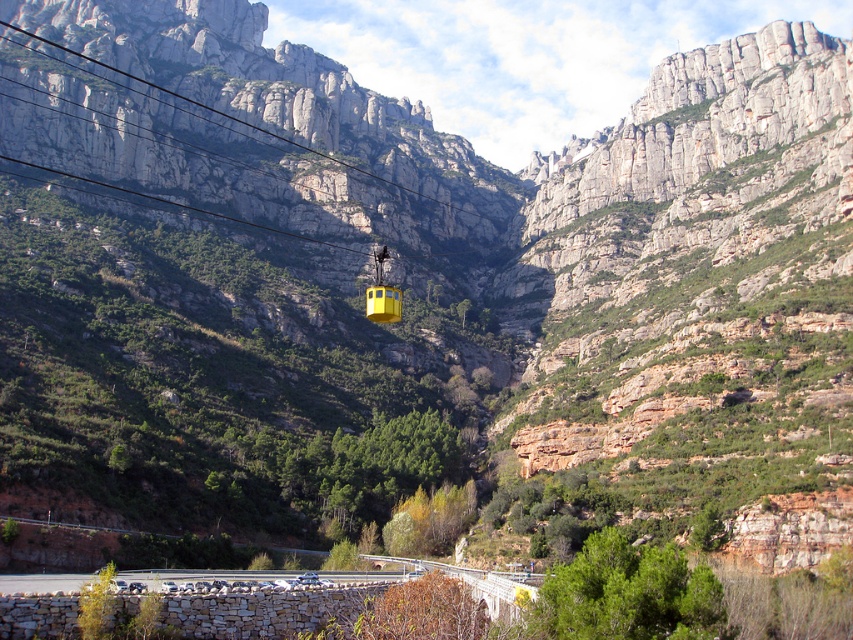
You are standing at the base of the mountain looking towards the cable car. There are two points marked on the image, point (18, 28) and point (380, 296). Which point is closer to your current position?

Point (18, 28) is further to the camera than point (380, 296), so the point closer to your current position is point (380, 296).

You are a hiker planning to take the cable car to the top of the mountain. You notice the smooth wire at upper center and the yellow matte cable car at center. Which object is closer to you as you stand at the base of the mountain?

The smooth wire at upper center is closer to you than the yellow matte cable car at center because it is further to the viewer.